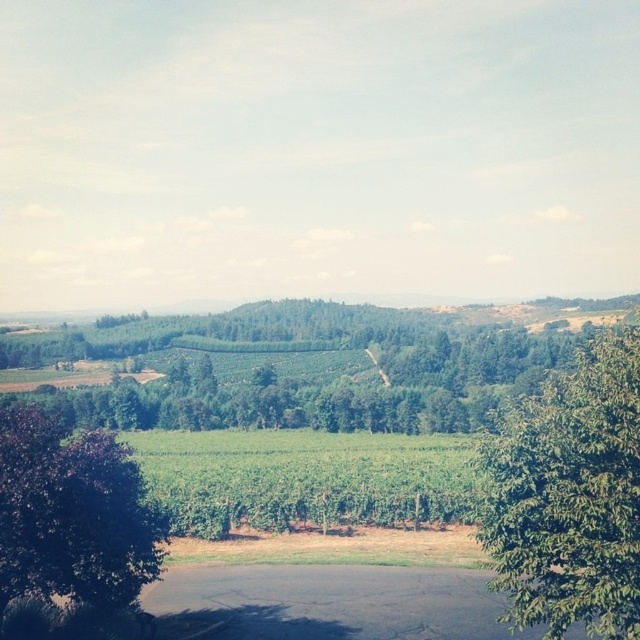
You are standing at the edge of the paved area and want to determine which tree is taller between the green leafy trees at center and the purple leafy tree at left. Based on the scene, which one is taller?

The green leafy trees at center is taller than the purple leafy tree at left according to the description.

You are standing at the edge of the vineyard and see the green leafy trees at center and the purple leafy tree at left. Which tree is closer to you?

The green leafy trees at center are closer to you because the purple leafy tree at left is behind them.